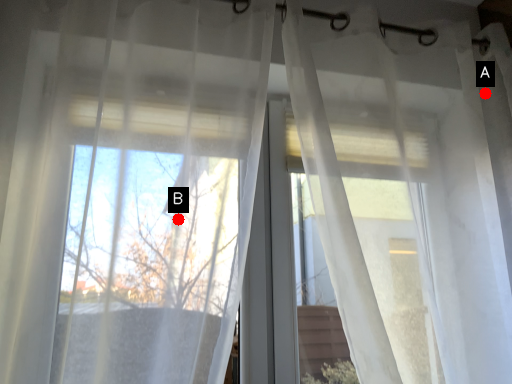
Question: Two points are circled on the image, labeled by A and B beside each circle. Which of the following is the closest to the observer?

Choices:
 (A) A is closer
 (B) B is closer

Answer: (B)